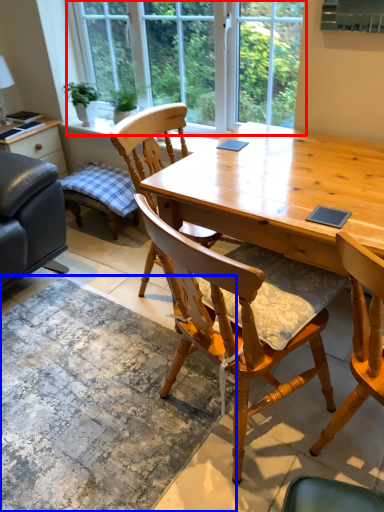
Question: Among these objects, which one is farthest to the camera, window (highlighted by a red box) or mat (highlighted by a blue box)?

Choices:
 (A) window
 (B) mat

Answer: (A)